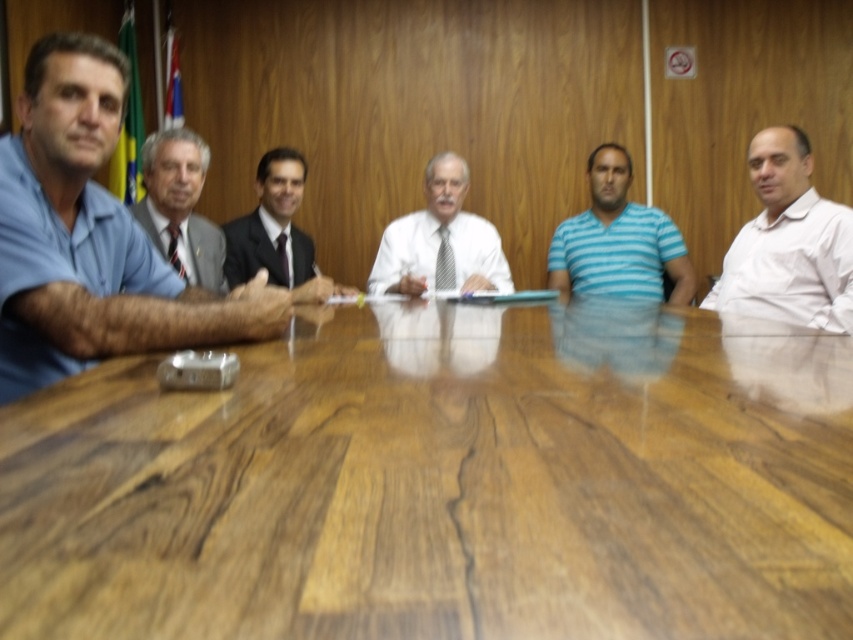
Question: Can you confirm if white shirt at right is positioned to the right of blue striped shirt at center?

Choices:
 (A) no
 (B) yes

Answer: (B)

Question: Which is nearer to the white shirt at right?

Choices:
 (A) dark blue suit at center
 (B) gray suit at center
 (C) wooden table at center

Answer: (C)

Question: Can you confirm if wooden table at center is positioned above white shirt at right?

Choices:
 (A) no
 (B) yes

Answer: (A)

Question: Does wooden table at center have a greater width compared to white glossy shirt at center?

Choices:
 (A) no
 (B) yes

Answer: (B)

Question: Which object is the farthest from the white glossy shirt at center?

Choices:
 (A) gray suit at center
 (B) blue cotton shirt at left
 (C) wooden table at center

Answer: (C)

Question: Which of these objects is positioned farthest from the gray suit at center?

Choices:
 (A) blue striped shirt at center
 (B) white shirt at right

Answer: (B)